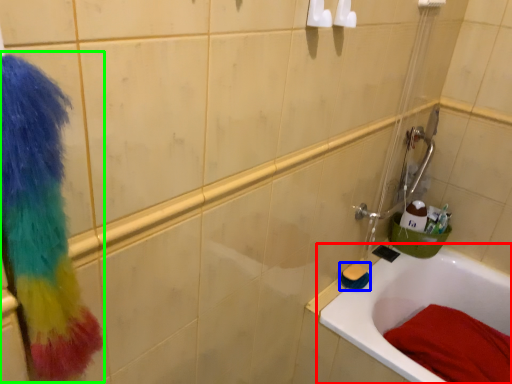
Question: Considering the real-world distances, which object is farthest from bathtub (highlighted by a red box)? brush (highlighted by a blue box) or scrub (highlighted by a green box)?

Choices:
 (A) brush
 (B) scrub

Answer: (B)